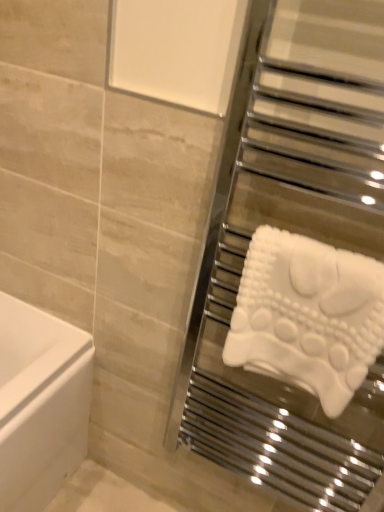
Question: Should I look upward or downward to see white textured towel at right?

Choices:
 (A) down
 (B) up

Answer: (A)